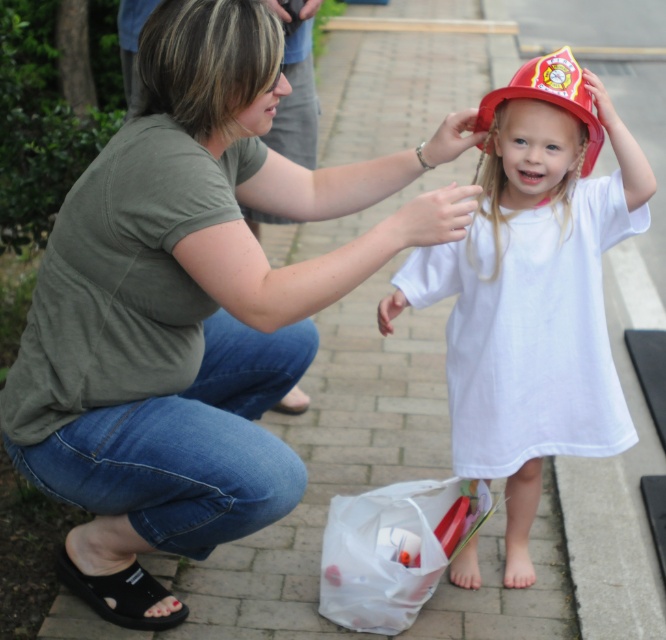
You are a delivery person who needs to place a small package between the matte red fire helmet at center and the black rubber sandal at lower left. Since the package is 10 cm tall, will it fit vertically between them?

The matte red fire helmet at center is taller than the black rubber sandal at lower left. The height difference means there is enough vertical space between them for the 10 cm tall package to fit vertically.